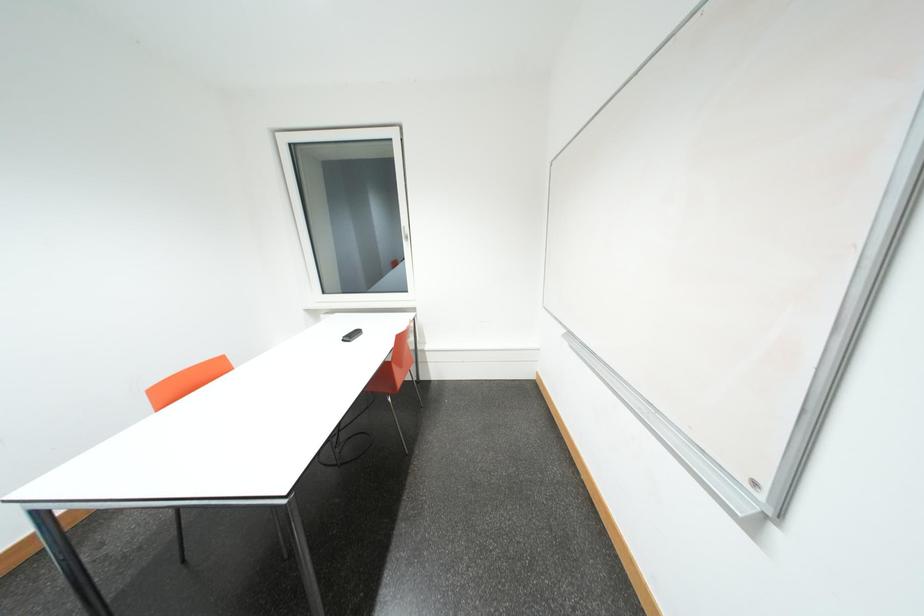
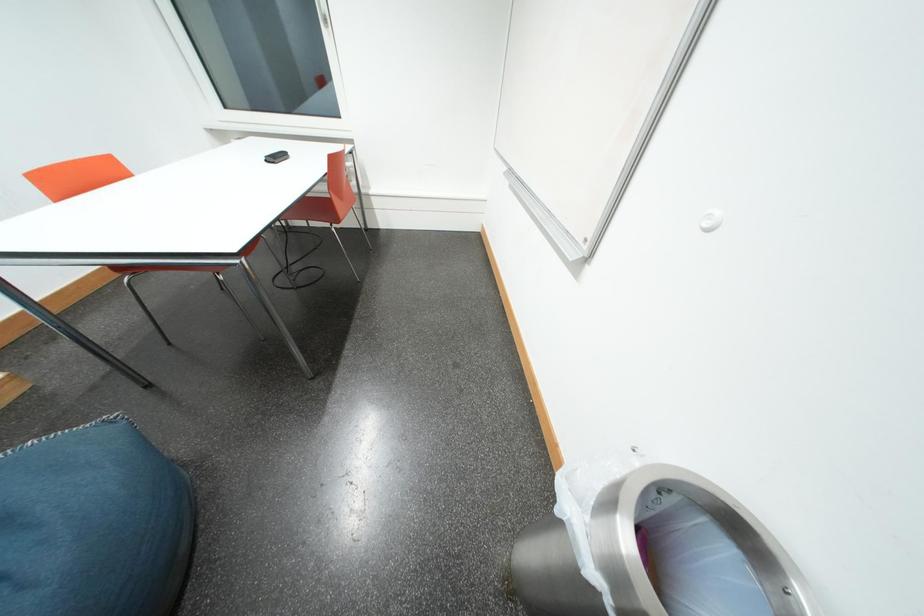
In a continuous first-person perspective shot, in which direction is the camera moving?

The cameraman walked toward right, backward.